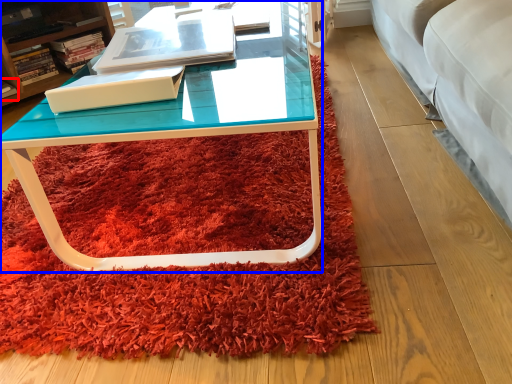
Question: Among these objects, which one is farthest to the camera, book (highlighted by a red box) or coffee table (highlighted by a blue box)?

Choices:
 (A) book
 (B) coffee table

Answer: (A)